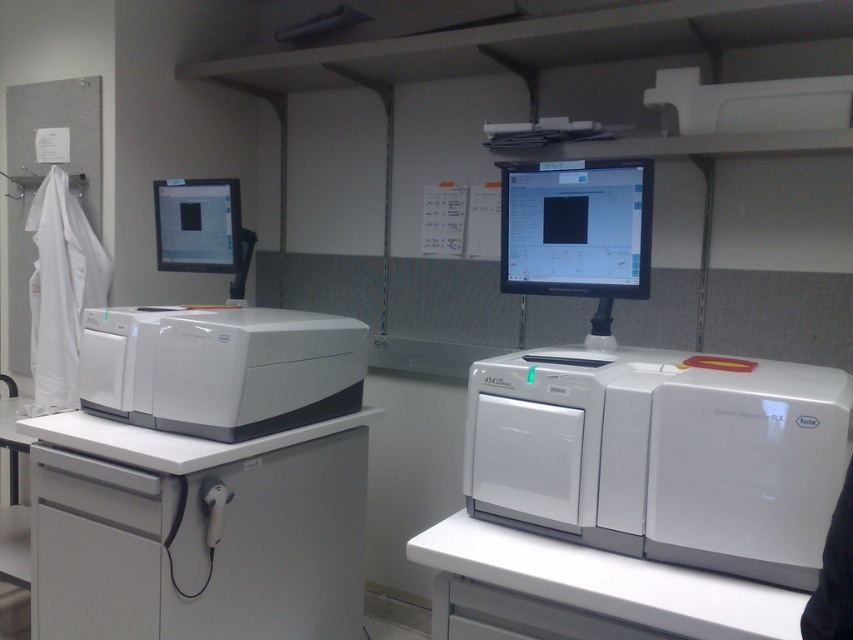
You are a researcher in the lab and need to move the white plastic printer at right closer to the white plastic equipment at left. Which direction should you move it?

The white plastic printer at right is already positioned on the right side of the white plastic equipment at left, so to move it closer, you should move it to the left.

You are a researcher in the lab. You need to access the monitor to check data but first must retrieve a sample from the printer. Which object should you approach first, the white plastic printer at right or the matte black monitor at center?

You should approach the white plastic printer at right first because it is in front of the matte black monitor at center, so you need to move the printer out of the way to access the monitor.

You are a lab technician who needs to place a sample on the white plastic printer at right. Given that the coordinate system starts at the bottom left corner of the image, can you confirm if the printer is positioned in the lower right quadrant of the image?

The white plastic printer at right is located at point coordinates 0.713 on the x and 0.777 on the y. Since the coordinate system starts at the bottom left, the lower right quadrant would have x values between 0.5 to 1.0 and y values between 0.0 to 0.5. The printer has an x value of 0.713 which is within the lower right quadrant but its y value of 0.777 places it in the upper right quadrant. Therefore, the printer is not in the lower right quadrant but rather in the upper right quadrant of the image.